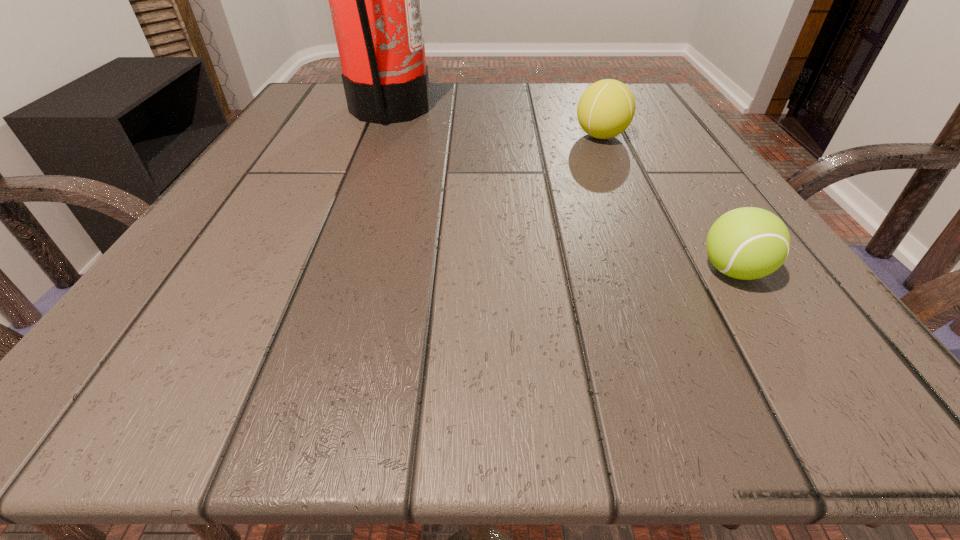
This screenshot has height=540, width=960. I want to click on empty location between the nearer tennis ball and the tallest object, so click(561, 191).

Identify the location of empty space that is in between the fire extinguisher and the farther tennis ball. Image resolution: width=960 pixels, height=540 pixels. (495, 123).

Where is `unoccupied position between the tallest object and the nearer tennis ball`? unoccupied position between the tallest object and the nearer tennis ball is located at coordinates (561, 191).

Find the location of a particular element. The image size is (960, 540). free spot between the tallest object and the shorter tennis ball is located at coordinates (561, 191).

This screenshot has height=540, width=960. I want to click on free point between the fire extinguisher and the nearest object, so click(x=561, y=191).

You are a GUI agent. You are given a task and a screenshot of the screen. Output one action in this format:
    pyautogui.click(x=<x>, y=<y>)
    Task: Click on the vacant area between the fire extinguisher and the farther tennis ball
    The height and width of the screenshot is (540, 960).
    Given the screenshot: What is the action you would take?
    pyautogui.click(x=495, y=123)

The height and width of the screenshot is (540, 960). In order to click on free space that is in between the farther tennis ball and the shorter tennis ball in this screenshot , I will do `click(667, 203)`.

Where is `vacant area that lies between the farther tennis ball and the shorter tennis ball`? The width and height of the screenshot is (960, 540). vacant area that lies between the farther tennis ball and the shorter tennis ball is located at coordinates (667, 203).

In order to click on empty space between the farther tennis ball and the leftmost object in this screenshot , I will do `click(495, 123)`.

You are a GUI agent. You are given a task and a screenshot of the screen. Output one action in this format:
    pyautogui.click(x=<x>, y=<y>)
    Task: Click on the free space that is in between the leftmost object and the shortest object
    This screenshot has width=960, height=540.
    Given the screenshot: What is the action you would take?
    pyautogui.click(x=561, y=191)